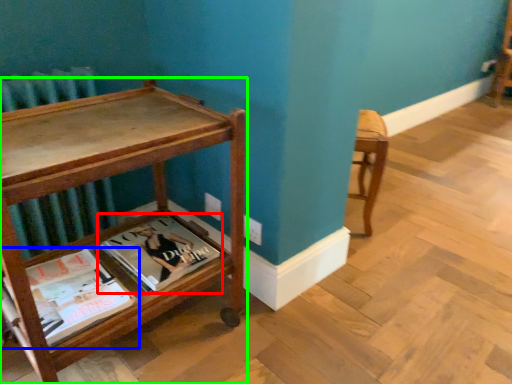
Question: Considering the real-world distances, which object is closest to book (highlighted by a red box)? book (highlighted by a blue box) or table (highlighted by a green box).

Choices:
 (A) book
 (B) table

Answer: (A)